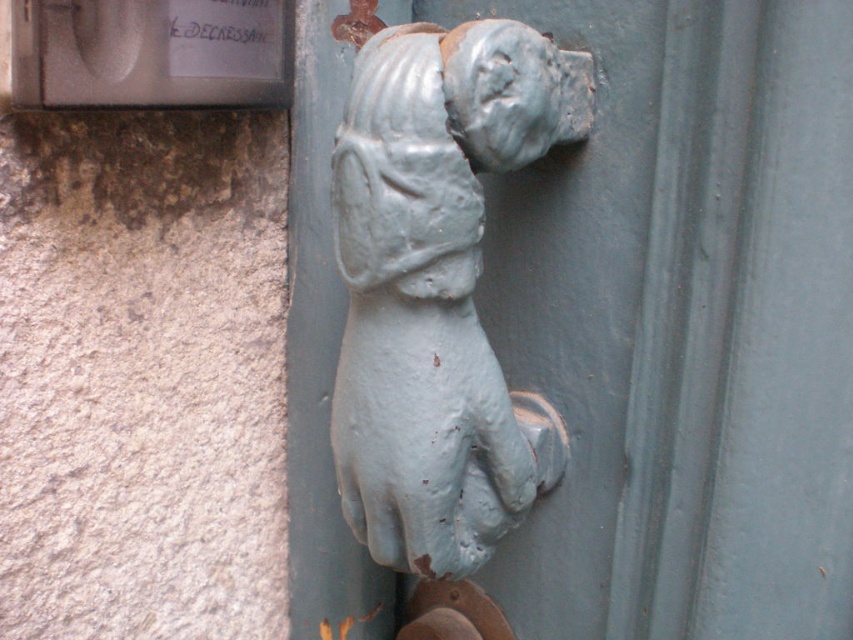
Question: Is light blue painted metal dog at center above rusty metal door handle at lower center?

Choices:
 (A) no
 (B) yes

Answer: (B)

Question: Is blue painted metal dog at center positioned before light blue painted metal dog at center?

Choices:
 (A) yes
 (B) no

Answer: (A)

Question: Can you confirm if blue painted metal dog at center is thinner than light blue painted metal dog at center?

Choices:
 (A) yes
 (B) no

Answer: (B)

Question: Which object appears closest to the camera in this image?

Choices:
 (A) rusty metal door handle at lower center
 (B) light blue painted metal dog at center
 (C) blue painted metal dog at center

Answer: (C)

Question: Which point is farther to the camera?

Choices:
 (A) (456, 584)
 (B) (711, 376)

Answer: (A)

Question: Among these points, which one is farthest from the camera?

Choices:
 (A) (601, 634)
 (B) (437, 257)

Answer: (A)